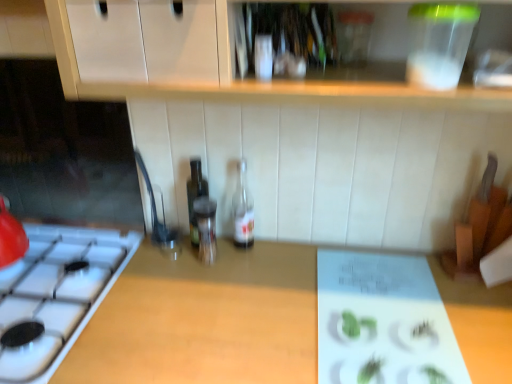
Question: From the image's perspective, would you say clear glass bottle at center, acting as the 3th bottle starting from the left, is shown under wooden at center?

Choices:
 (A) no
 (B) yes

Answer: (A)

Question: Is clear glass bottle at center, acting as the 3th bottle starting from the left, closer to the viewer compared to wooden at center?

Choices:
 (A) yes
 (B) no

Answer: (B)

Question: Considering the relative sizes of clear glass bottle at center, acting as the 3th bottle starting from the left, and wooden at center in the image provided, is clear glass bottle at center, acting as the 3th bottle starting from the left, bigger than wooden at center?

Choices:
 (A) yes
 (B) no

Answer: (B)

Question: Is clear glass bottle at center, acting as the 3th bottle starting from the left, in contact with wooden at center?

Choices:
 (A) no
 (B) yes

Answer: (A)

Question: Is clear glass bottle at center, the first bottle positioned from the right, further to camera compared to wooden at center?

Choices:
 (A) no
 (B) yes

Answer: (B)

Question: Is wooden at center inside or outside of transparent glass bottle at center, which is the 2th bottle from left to right?

Choices:
 (A) inside
 (B) outside

Answer: (B)

Question: From a real-world perspective, is wooden at center positioned above or below transparent glass bottle at center, which is the 2th bottle from left to right?

Choices:
 (A) below
 (B) above

Answer: (A)

Question: From their relative heights in the image, would you say wooden at center is taller or shorter than transparent glass bottle at center, the 2th bottle positioned from the right?

Choices:
 (A) short
 (B) tall

Answer: (B)

Question: From the image's perspective, relative to transparent glass bottle at center, the 2th bottle positioned from the right, is wooden at center above or below?

Choices:
 (A) below
 (B) above

Answer: (A)

Question: From the image's perspective, is transparent glass bottle at center, which is the 2th bottle from left to right, positioned above or below wooden at center?

Choices:
 (A) above
 (B) below

Answer: (A)

Question: Considering the positions of transparent glass bottle at center, the 2th bottle positioned from the right, and wooden at center in the image, is transparent glass bottle at center, the 2th bottle positioned from the right, taller or shorter than wooden at center?

Choices:
 (A) tall
 (B) short

Answer: (B)

Question: Considering the positions of point (214, 248) and point (470, 344), is point (214, 248) closer or farther from the camera than point (470, 344)?

Choices:
 (A) closer
 (B) farther

Answer: (B)

Question: Looking at the image, does transparent glass bottle at center, the 2th bottle positioned from the right, seem bigger or smaller compared to wooden at center?

Choices:
 (A) small
 (B) big

Answer: (A)

Question: In terms of width, does clear glass bottle at center, the first bottle positioned from the right, look wider or thinner when compared to wooden at center?

Choices:
 (A) wide
 (B) thin

Answer: (B)

Question: From a real-world perspective, is clear glass bottle at center, acting as the 3th bottle starting from the left, physically located above or below wooden at center?

Choices:
 (A) above
 (B) below

Answer: (A)